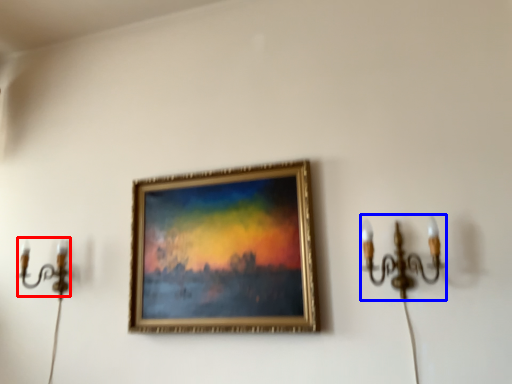
Question: Which of the following is the closest to the observer, candle holder (highlighted by a red box) or candle holder (highlighted by a blue box)?

Choices:
 (A) candle holder
 (B) candle holder

Answer: (B)